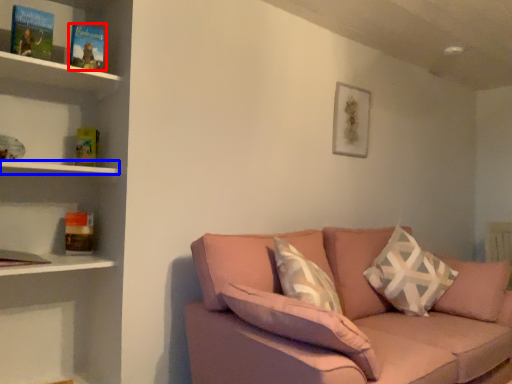
Question: Which object appears closest to the camera in this image, paperback book (highlighted by a red box) or shelf (highlighted by a blue box)?

Choices:
 (A) paperback book
 (B) shelf

Answer: (B)